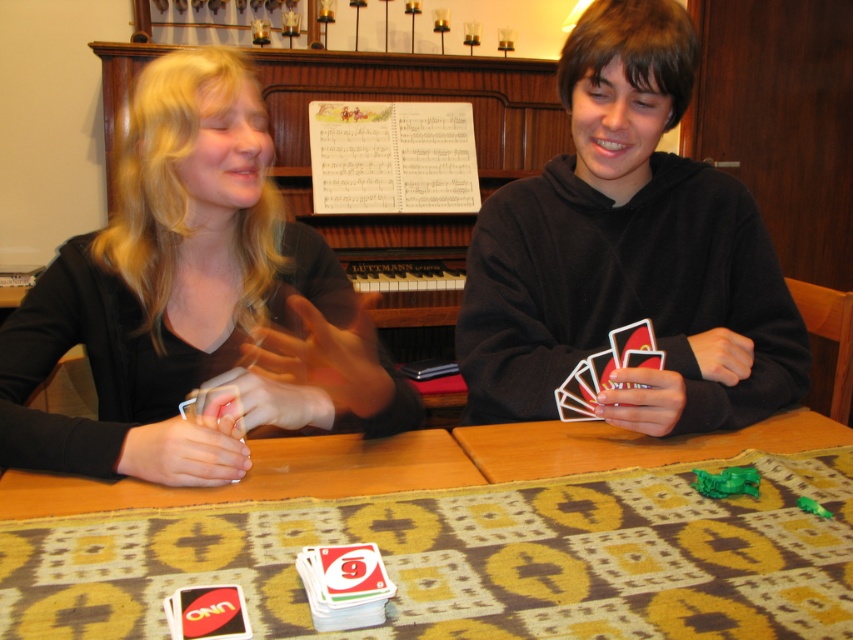
Question: Can you confirm if wooden table at center is positioned to the right of smooth black shirt at left?

Choices:
 (A) yes
 (B) no

Answer: (A)

Question: Which of the following is the closest to the observer?

Choices:
 (A) smooth plastic cards at center
 (B) black matte hoodie at center
 (C) wooden table at center
 (D) smooth black shirt at left

Answer: (C)

Question: Which of these objects is positioned closest to the smooth black shirt at left?

Choices:
 (A) smooth plastic cards at center
 (B) wooden table at center
 (C) black matte hoodie at center

Answer: (A)

Question: Based on their relative distances, which object is nearer to the wooden table at center?

Choices:
 (A) smooth plastic cards at center
 (B) black matte hoodie at center

Answer: (A)

Question: Where is wooden table at center located in relation to smooth plastic cards at center in the image?

Choices:
 (A) above
 (B) below

Answer: (B)

Question: Is smooth black shirt at left bigger than black matte hoodie at center?

Choices:
 (A) yes
 (B) no

Answer: (A)